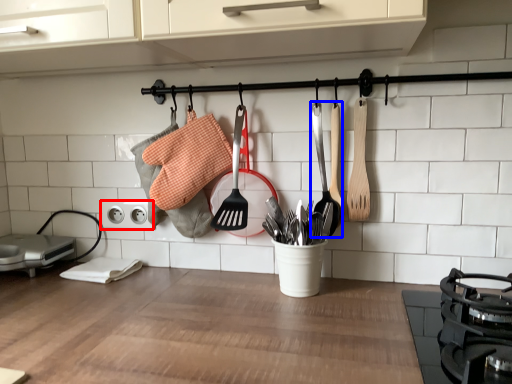
Question: Among these objects, which one is farthest to the camera, electric outlet (highlighted by a red box) or spatula (highlighted by a blue box)?

Choices:
 (A) electric outlet
 (B) spatula

Answer: (A)